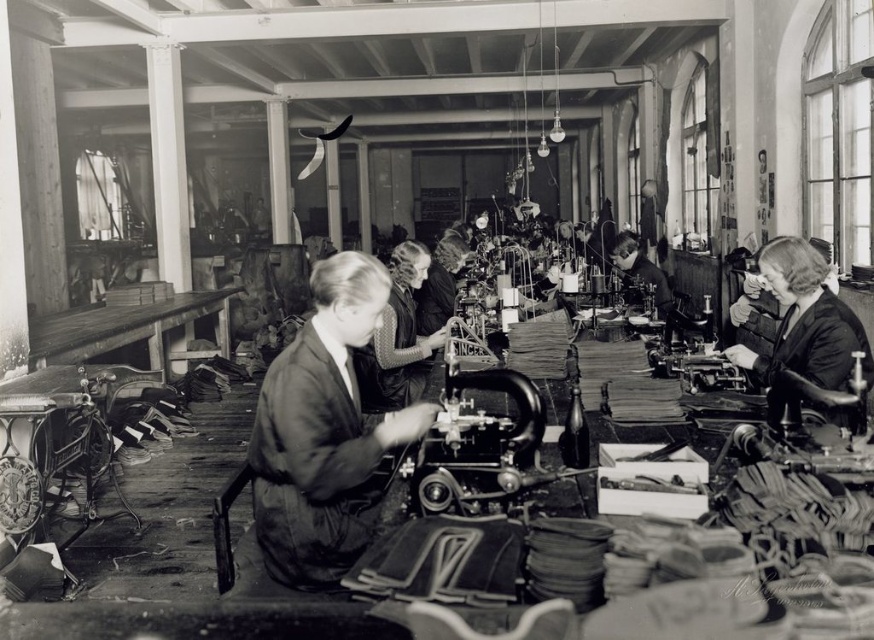
Question: Which point is farther to the camera?

Choices:
 (A) dark fabric jacket at center
 (B) matte black dress at center
 (C) smooth black dress at right
 (D) smooth leather jacket at center

Answer: (D)

Question: Can you confirm if smooth black dress at right is positioned above matte black dress at center?

Choices:
 (A) yes
 (B) no

Answer: (B)

Question: Is smooth black dress at right to the right of matte black dress at center from the viewer's perspective?

Choices:
 (A) no
 (B) yes

Answer: (B)

Question: Which object is positioned farthest from the smooth black dress at right?

Choices:
 (A) dark fabric jacket at center
 (B) smooth leather jacket at center

Answer: (B)

Question: Can you confirm if dark fabric jacket at center is positioned to the left of smooth leather jacket at center?

Choices:
 (A) no
 (B) yes

Answer: (B)

Question: Which object is closer to the camera taking this photo?

Choices:
 (A) dark fabric jacket at center
 (B) smooth leather jacket at center
 (C) smooth black dress at right
 (D) matte black dress at center

Answer: (A)